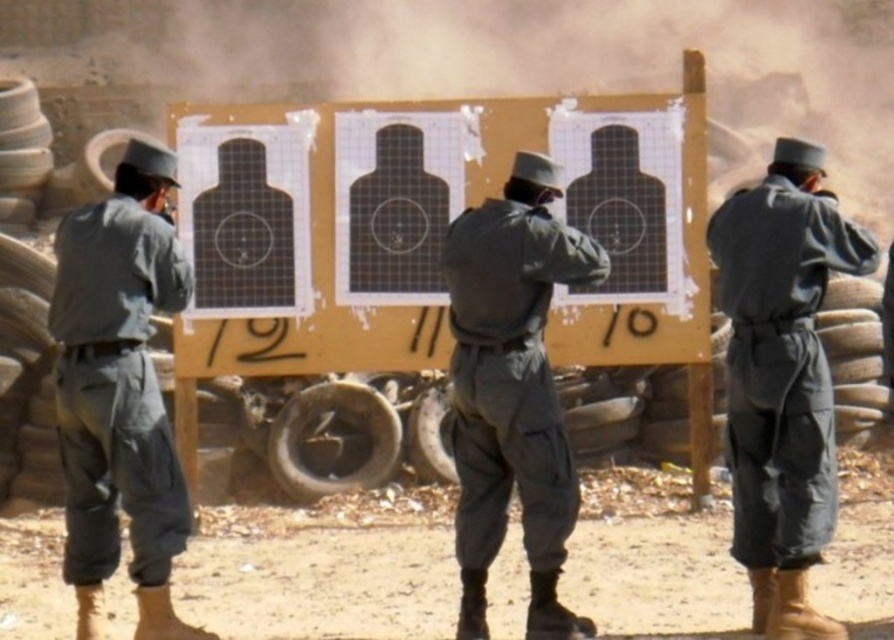
Question: Is the position of matte gray uniform at center less distant than that of dark gray fabric uniform at left?

Choices:
 (A) yes
 (B) no

Answer: (A)

Question: Which point appears farthest from the camera in this image?

Choices:
 (A) (515, 214)
 (B) (72, 452)
 (C) (814, 618)

Answer: (A)

Question: Which of the following is the farthest from the observer?

Choices:
 (A) matte gray uniform at center
 (B) dark gray uniform at center
 (C) dark gray fabric uniform at left

Answer: (C)

Question: Estimate the real-world distances between objects in this image. Which object is farther from the matte gray uniform at center?

Choices:
 (A) dark gray uniform at center
 (B) dark gray fabric uniform at left

Answer: (B)

Question: Is matte gray uniform at center above dark gray uniform at center?

Choices:
 (A) no
 (B) yes

Answer: (A)

Question: Considering the relative positions of dark gray uniform at center and dark gray fabric uniform at left in the image provided, where is dark gray uniform at center located with respect to dark gray fabric uniform at left?

Choices:
 (A) below
 (B) above

Answer: (A)